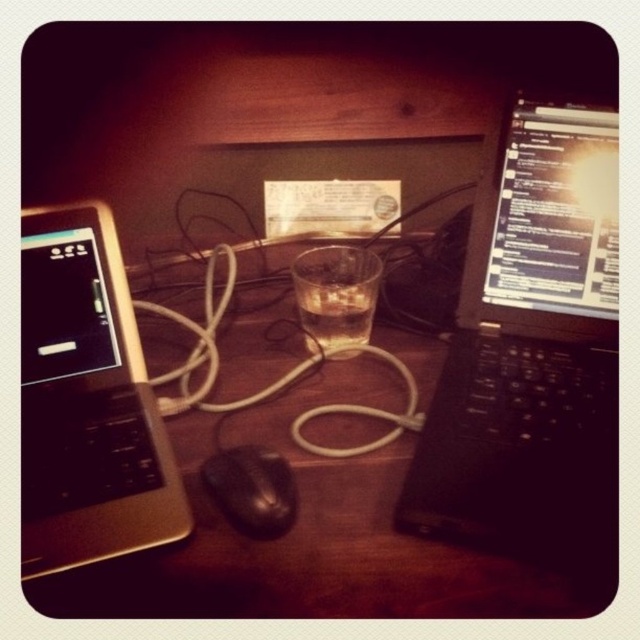
Question: Does wooden desk at center appear under black matte mouse at center?

Choices:
 (A) no
 (B) yes

Answer: (A)

Question: Does black matte laptop at right lie in front of black matte mouse at center?

Choices:
 (A) yes
 (B) no

Answer: (A)

Question: Among these objects, which one is farthest from the camera?

Choices:
 (A) black matte laptop at right
 (B) silver metallic laptop at left
 (C) black matte mouse at center
 (D) wooden desk at center

Answer: (C)

Question: Which point is farther to the camera?

Choices:
 (A) silver metallic laptop at left
 (B) wooden desk at center
 (C) black matte laptop at right
 (D) black matte mouse at center

Answer: (D)

Question: Does wooden desk at center have a lesser width compared to silver metallic laptop at left?

Choices:
 (A) yes
 (B) no

Answer: (B)

Question: Which point is closer to the camera?

Choices:
 (A) (147, 464)
 (B) (576, 596)

Answer: (B)